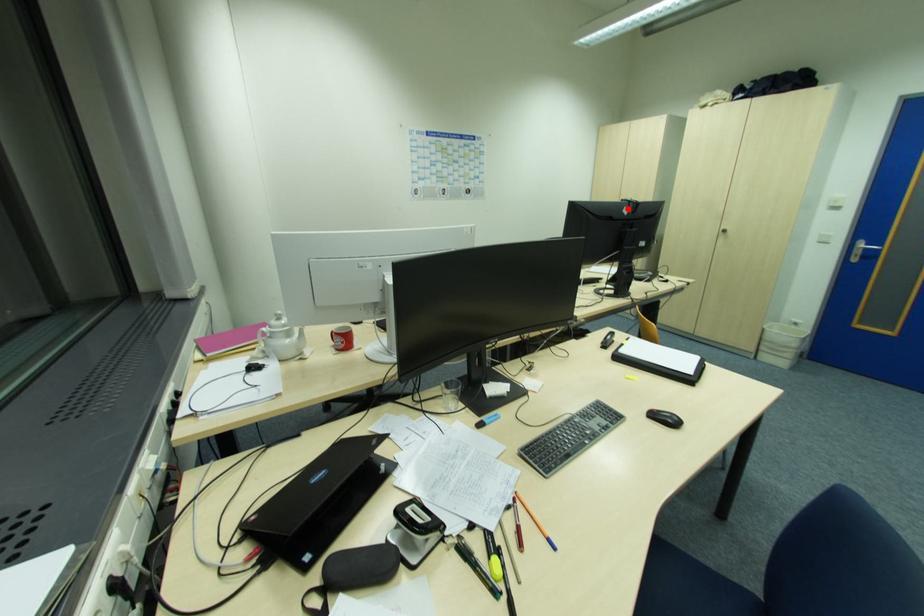
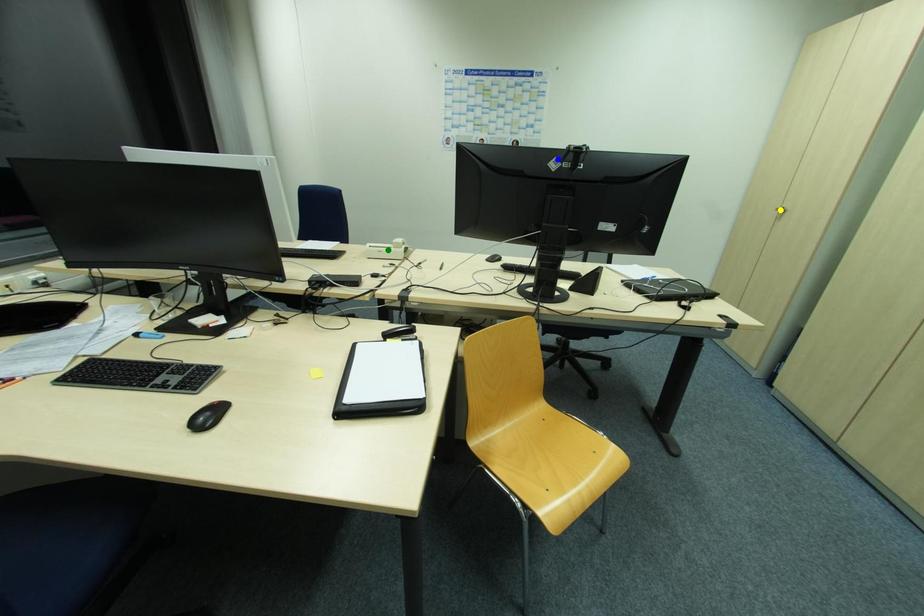
Question: I am providing you with two images of the same scene from different viewpoints. A red point is marked on the first image. You are given multiple points on the second image. Which point in image 2 is actually the same real-world point as the red point in image 1?

Choices:
 (A) blue point
 (B) green point
 (C) yellow point

Answer: (A)